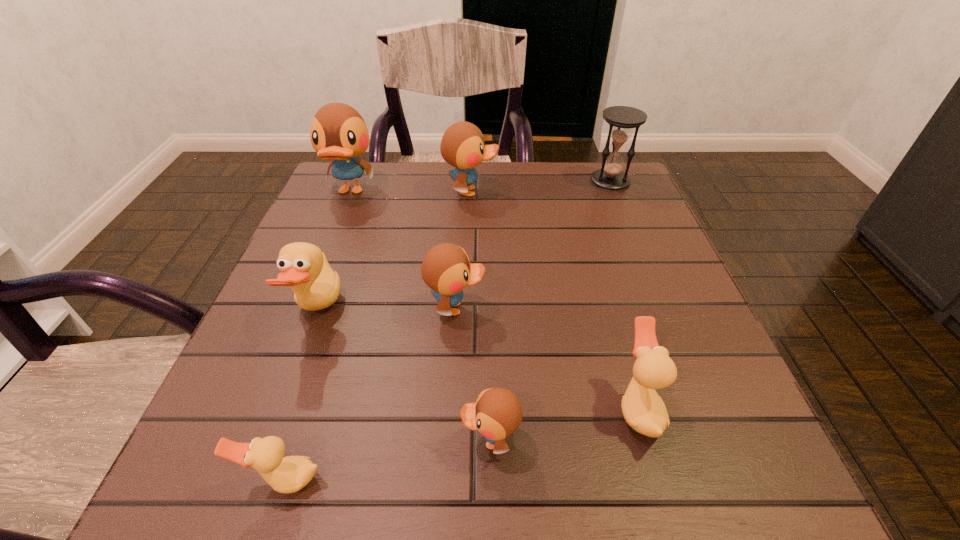
Find the location of a particular element. The image size is (960, 540). the nearest tan duck is located at coordinates click(x=290, y=474).

Where is `vacant region located 0.310m on the front-facing side of the leftmost blue duck`? Image resolution: width=960 pixels, height=540 pixels. vacant region located 0.310m on the front-facing side of the leftmost blue duck is located at coordinates (306, 303).

Locate an element on the screen. vacant region located on the front-facing side of the second biggest blue duck is located at coordinates (545, 192).

Find the location of `free space located 0.150m on the front of the black hourglass`. free space located 0.150m on the front of the black hourglass is located at coordinates (629, 227).

Where is `vacant region located 0.360m on the beak of the biggest tan duck`? This screenshot has height=540, width=960. vacant region located 0.360m on the beak of the biggest tan duck is located at coordinates (533, 311).

Where is `vacant area situated on the front-facing side of the second nearest blue duck`? The height and width of the screenshot is (540, 960). vacant area situated on the front-facing side of the second nearest blue duck is located at coordinates (661, 308).

Locate an element on the screen. vacant space situated on the beak of the second biggest tan duck is located at coordinates (531, 408).

Locate an element on the screen. Image resolution: width=960 pixels, height=540 pixels. vacant space located 0.370m on the beak of the second biggest tan duck is located at coordinates (374, 408).

Where is `vacant point located on the beak of the second biggest tan duck`? The width and height of the screenshot is (960, 540). vacant point located on the beak of the second biggest tan duck is located at coordinates (394, 408).

Where is `free space located 0.050m on the front-facing side of the nearest blue duck`? Image resolution: width=960 pixels, height=540 pixels. free space located 0.050m on the front-facing side of the nearest blue duck is located at coordinates (427, 440).